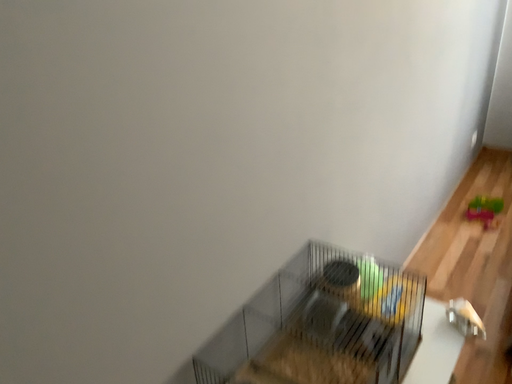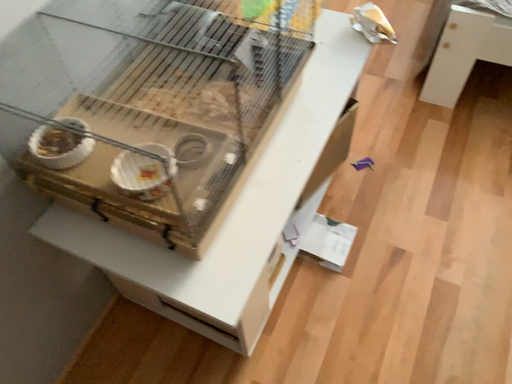
Question: Which way did the camera rotate in the video?

Choices:
 (A) rotated left
 (B) rotated right

Answer: (B)